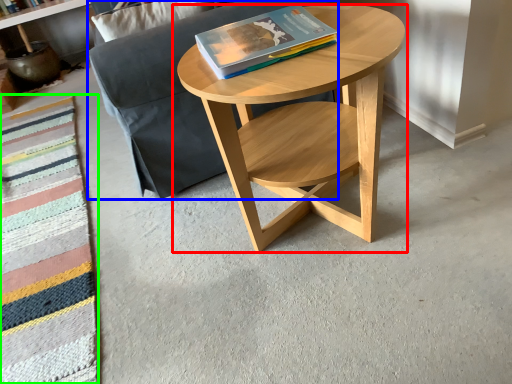
Question: Which object is positioned closest to coffee table (highlighted by a red box)? Select from couch (highlighted by a blue box) and blanket (highlighted by a green box).

Choices:
 (A) couch
 (B) blanket

Answer: (A)